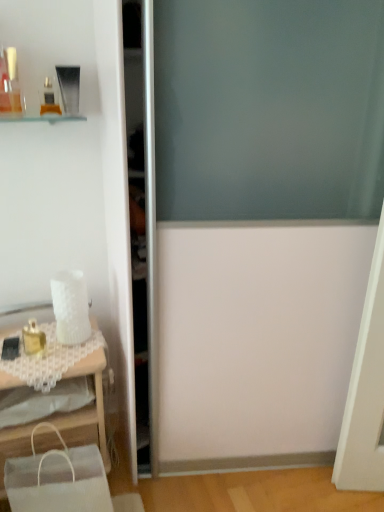
I want to click on vacant area that lies to the right of gold metallic perfume at left, marked as the third toiletry in a top-to-bottom arrangement, so click(74, 350).